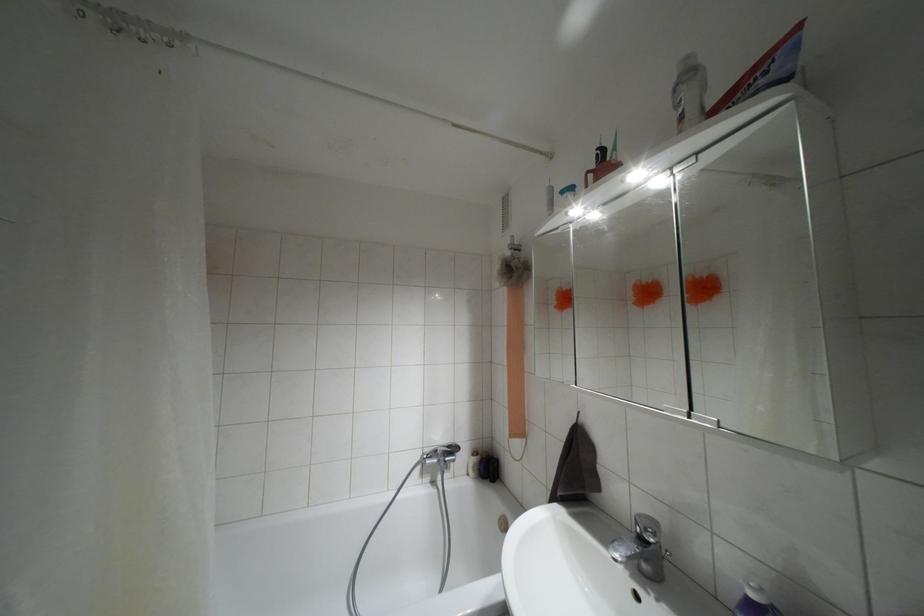
This screenshot has height=616, width=924. Identify the location of sink faucet handle. (649, 532).